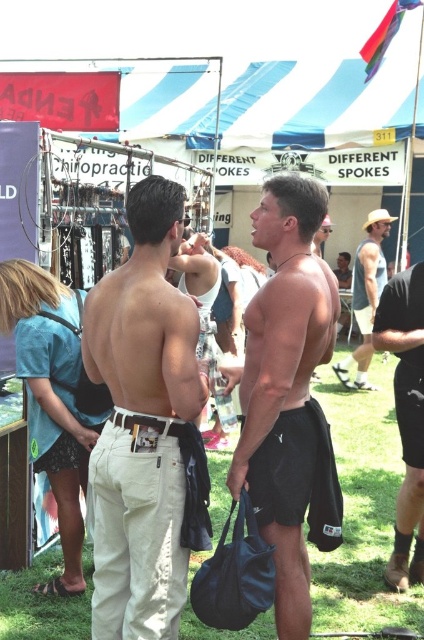
Does tan cotton pants at center appear under denim shorts at lower left?

No, tan cotton pants at center is not below denim shorts at lower left.

Which is behind, point (125, 268) or point (8, 326)?

Positioned behind is point (8, 326).

Is point (133, 310) positioned after point (55, 362)?

No, it is in front of (55, 362).

Find the location of `tan cotton pants at center`. tan cotton pants at center is located at coordinates coord(142,422).

The height and width of the screenshot is (640, 424). Describe the element at coordinates (142, 422) in the screenshot. I see `tan cotton pants at center` at that location.

Which is in front, point (137, 614) or point (402, 538)?

Point (137, 614) is more forward.

Is point (161, 515) positioned before point (410, 509)?

Yes, it is in front of point (410, 509).

The width and height of the screenshot is (424, 640). Identify the location of tan cotton pants at center. (142, 422).

Between denim shorts at lower left and black leather boots at lower right, which one has more height?

Standing taller between the two is black leather boots at lower right.

Is the position of denim shorts at lower left less distant than that of black leather boots at lower right?

Yes, denim shorts at lower left is closer to the viewer.

Does point (67, 483) come closer to viewer compared to point (421, 330)?

Yes, point (67, 483) is closer to viewer.

Find the location of a particular element. The width and height of the screenshot is (424, 640). denim shorts at lower left is located at coordinates (53, 397).